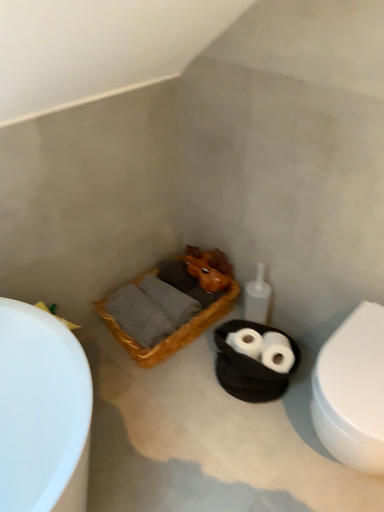
Question: Is white glossy toilet at right beside black woven basket at center?

Choices:
 (A) no
 (B) yes

Answer: (A)

Question: From a real-world perspective, is white glossy toilet at right on top of black woven basket at center?

Choices:
 (A) no
 (B) yes

Answer: (B)

Question: Is there a large distance between white glossy toilet at right and black woven basket at center?

Choices:
 (A) yes
 (B) no

Answer: (B)

Question: From a real-world perspective, is white glossy toilet at right physically below black woven basket at center?

Choices:
 (A) no
 (B) yes

Answer: (A)

Question: Does white glossy toilet at right turn towards black woven basket at center?

Choices:
 (A) yes
 (B) no

Answer: (B)

Question: Is white glossy toilet at right wider or thinner than woven wood basket at center?

Choices:
 (A) thin
 (B) wide

Answer: (A)

Question: Is white glossy toilet at right spatially inside woven wood basket at center, or outside of it?

Choices:
 (A) inside
 (B) outside

Answer: (B)

Question: Considering the positions of point (382, 433) and point (187, 338), is point (382, 433) closer or farther from the camera than point (187, 338)?

Choices:
 (A) farther
 (B) closer

Answer: (B)

Question: Looking at the image, does white glossy toilet at right seem bigger or smaller compared to woven wood basket at center?

Choices:
 (A) big
 (B) small

Answer: (A)

Question: In the image, is woven wood basket at center positioned in front of or behind white glossy toilet at right?

Choices:
 (A) front
 (B) behind

Answer: (B)

Question: Considering the positions of woven wood basket at center and white glossy toilet at right in the image, is woven wood basket at center wider or thinner than white glossy toilet at right?

Choices:
 (A) wide
 (B) thin

Answer: (A)

Question: Is point (135, 349) positioned closer to the camera than point (380, 413)?

Choices:
 (A) closer
 (B) farther

Answer: (B)

Question: Is woven wood basket at center taller or shorter than white glossy toilet at right?

Choices:
 (A) tall
 (B) short

Answer: (B)

Question: Considering their positions, is white matte toilet paper at center located in front of or behind white glossy bathtub at left?

Choices:
 (A) front
 (B) behind

Answer: (B)

Question: Is white matte toilet paper at center bigger or smaller than white glossy bathtub at left?

Choices:
 (A) big
 (B) small

Answer: (B)